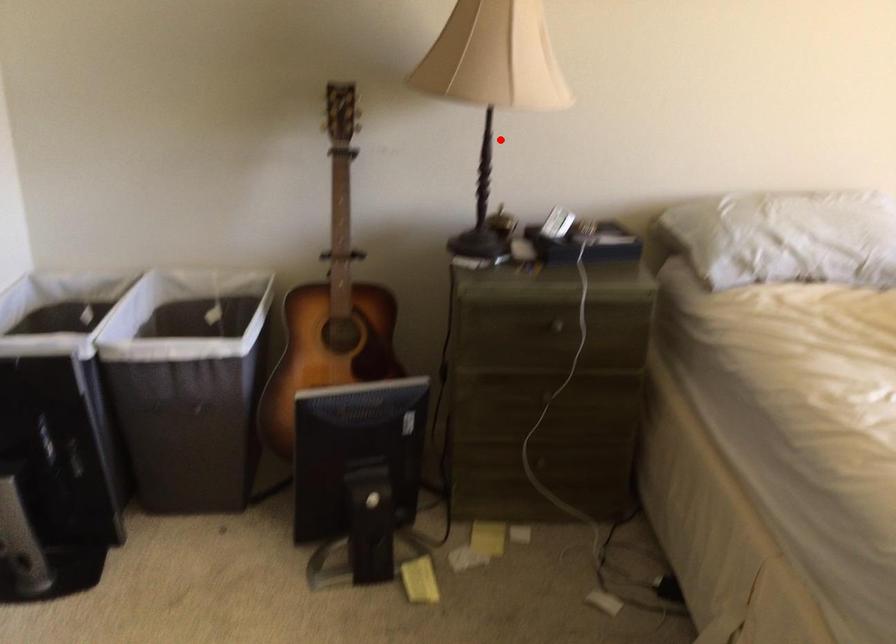
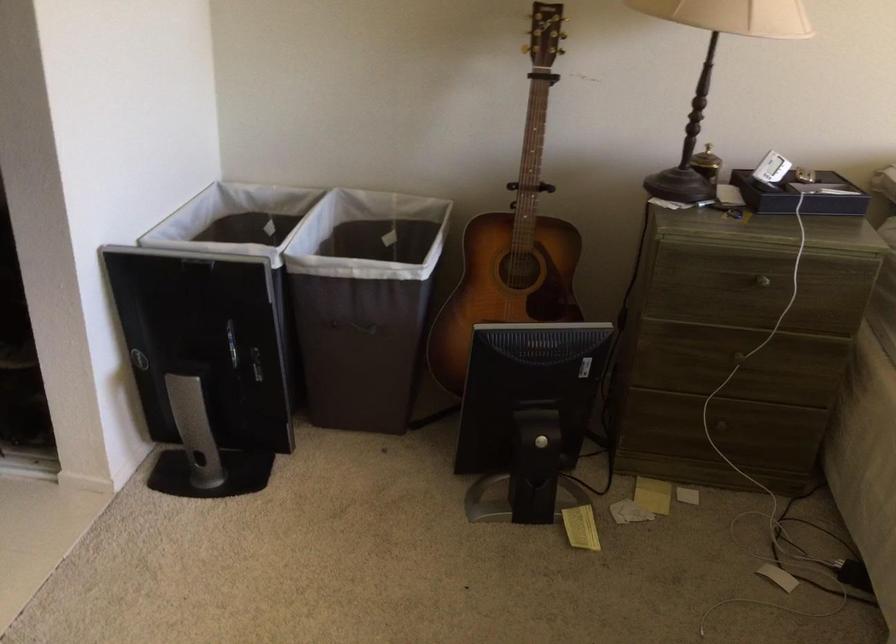
Question: A red point is marked in image1. In image2, is the corresponding 3D point closer to the camera or farther? Reply with the corresponding letter.

Choices:
 (A) The corresponding 3D point is closer.
 (B) The corresponding 3D point is farther.

Answer: (A)